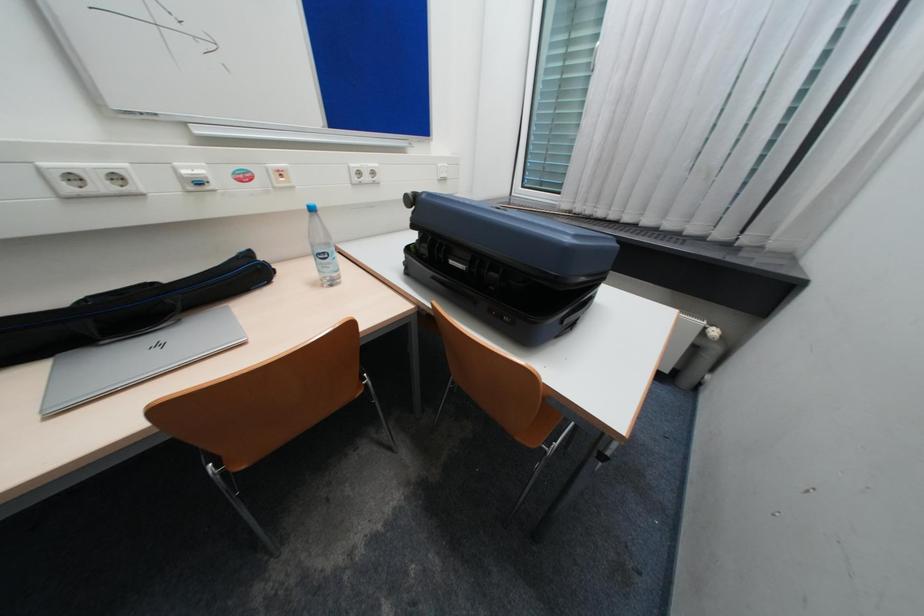
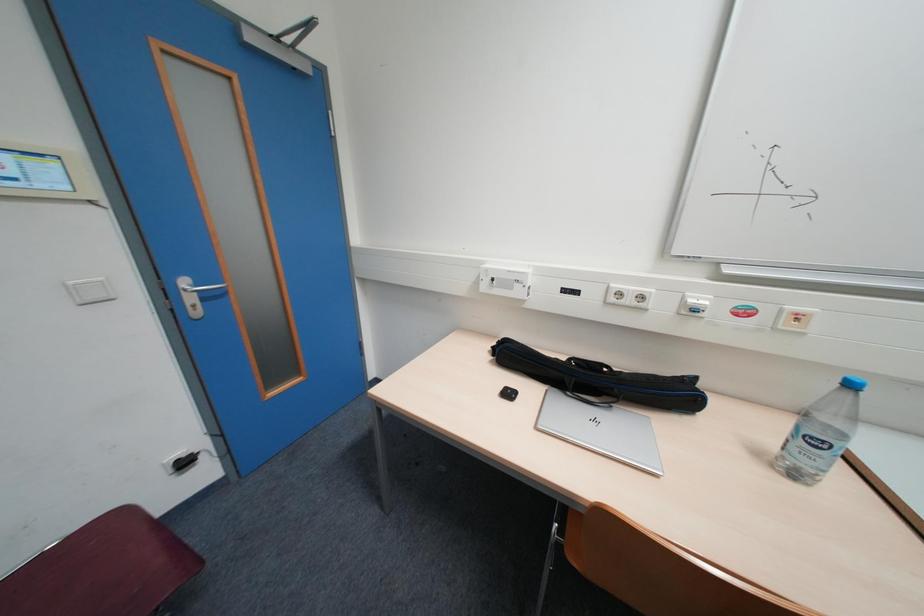
Question: Based on the continuous images, in which direction is the camera rotating? Reply with the corresponding letter.

Choices:
 (A) Left
 (B) Right
 (C) Up
 (D) Down

Answer: (A)